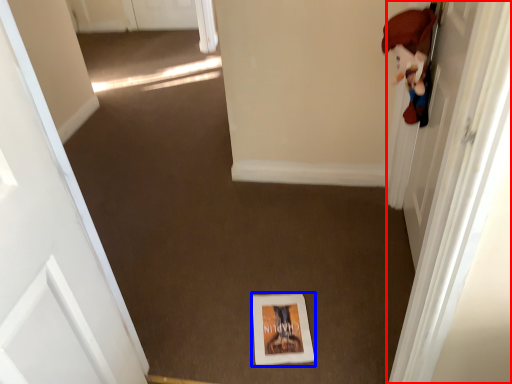
Question: Which point is further to the camera, door (highlighted by a red box) or print (highlighted by a blue box)?

Choices:
 (A) door
 (B) print

Answer: (B)